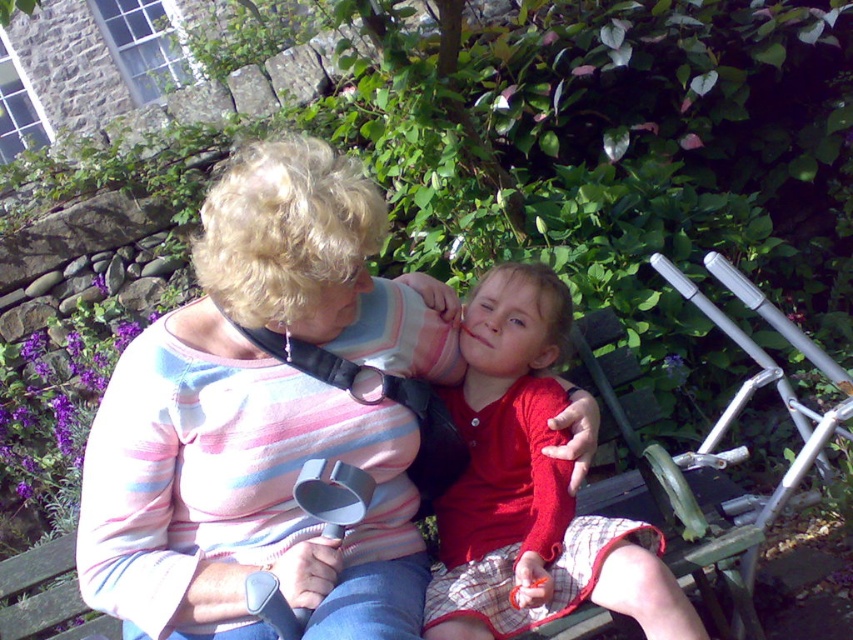
Is point (157, 500) behind point (514, 285)?

No, (157, 500) is closer to viewer.

What do you see at coordinates (250, 429) in the screenshot? I see `striped cotton sweater at center` at bounding box center [250, 429].

Find the location of a particular element. The height and width of the screenshot is (640, 853). striped cotton sweater at center is located at coordinates (250, 429).

Between point (654, 259) and point (357, 285), which one is positioned in front?

Point (357, 285)

The width and height of the screenshot is (853, 640). What do you see at coordinates (763, 380) in the screenshot? I see `silver metallic baby carriage at right` at bounding box center [763, 380].

What are the coordinates of `silver metallic baby carriage at right` in the screenshot? It's located at (763, 380).

Is striped cotton sweater at center further to camera compared to matte red sweater at center?

No.

Which is in front, point (227, 304) or point (639, 595)?

Point (639, 595) is in front.

Which is in front, point (225, 536) or point (556, 284)?

Positioned in front is point (225, 536).

Find the location of a particular element. striped cotton sweater at center is located at coordinates (250, 429).